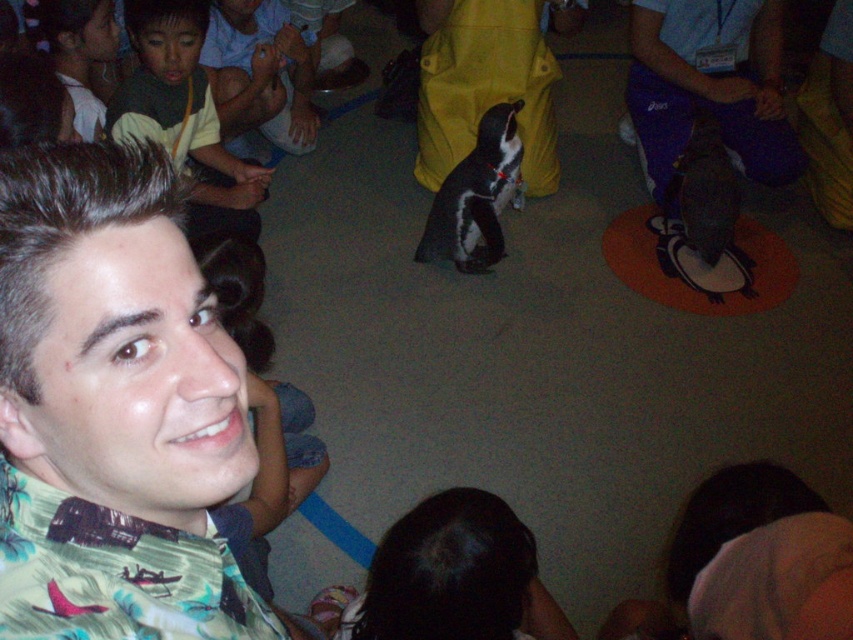
Between floral fabric shirt at center and light brown hair at upper left, which one appears on the left side from the viewer's perspective?

Positioned to the left is light brown hair at upper left.

The width and height of the screenshot is (853, 640). Identify the location of floral fabric shirt at center. (112, 410).

Who is more distant from viewer, (252, 173) or (80, 116)?

The point (252, 173) is behind.

Where is `matte green shirt at left`? This screenshot has width=853, height=640. matte green shirt at left is located at coordinates (183, 115).

Is the position of floral fabric shirt at center more distant than that of matte green shirt at left?

No, floral fabric shirt at center is in front of matte green shirt at left.

Does floral fabric shirt at center have a lesser width compared to matte green shirt at left?

Yes, floral fabric shirt at center is thinner than matte green shirt at left.

Does point (114, 333) come closer to viewer compared to point (146, 44)?

Yes, point (114, 333) is in front of point (146, 44).

This screenshot has width=853, height=640. In order to click on floral fabric shirt at center in this screenshot , I will do coord(112,410).